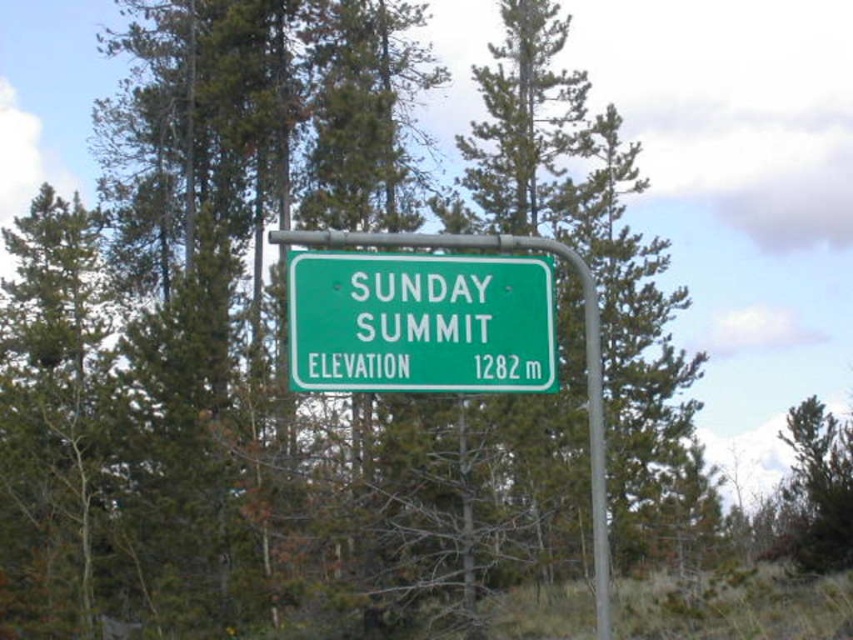
Question: Observing the image, what is the correct spatial positioning of green matte sign at center in reference to green pine tree at center?

Choices:
 (A) left
 (B) right

Answer: (A)

Question: Considering the relative positions of green matte sign at center and green pine tree at center in the image provided, where is green matte sign at center located with respect to green pine tree at center?

Choices:
 (A) above
 (B) below

Answer: (A)

Question: Among these points, which one is farthest from the camera?

Choices:
 (A) (519, 339)
 (B) (814, 524)

Answer: (B)

Question: Can you confirm if green matte sign at center is positioned above green pine tree at center?

Choices:
 (A) no
 (B) yes

Answer: (B)

Question: Among these points, which one is nearest to the camera?

Choices:
 (A) (485, 298)
 (B) (830, 499)

Answer: (A)